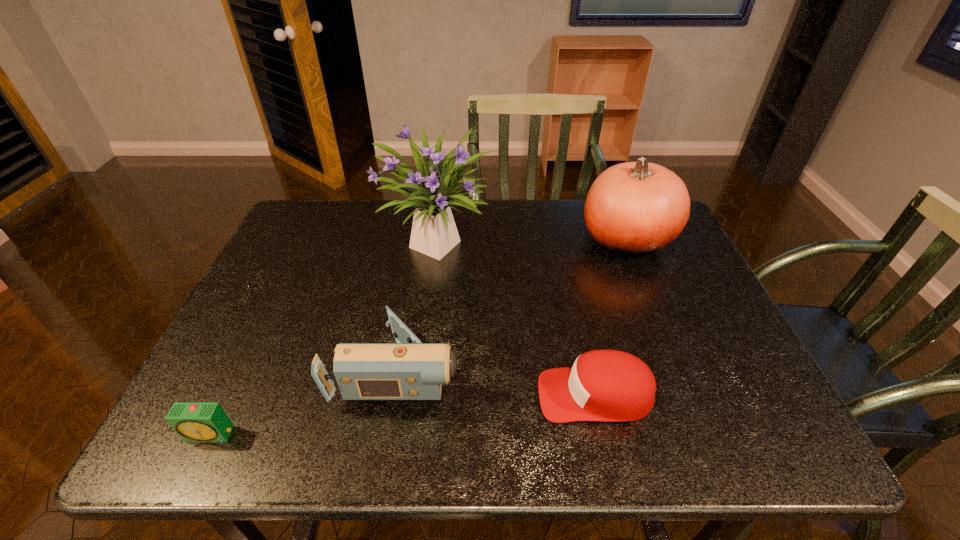
Where is `free point that satisfies the following two spatial constraints: 1. on the front-facing side of the baseball cap; 2. on the front-facing side of the alarm clock`? free point that satisfies the following two spatial constraints: 1. on the front-facing side of the baseball cap; 2. on the front-facing side of the alarm clock is located at coordinates (604, 434).